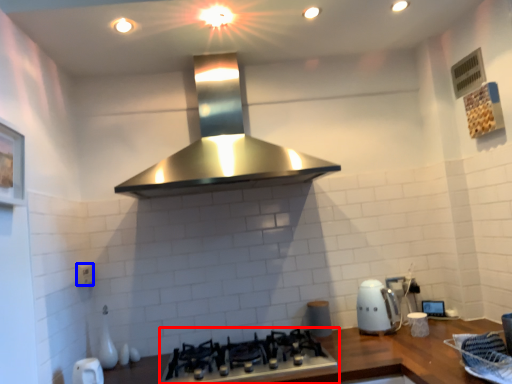
Question: Among these objects, which one is nearest to the camera, gas stove (highlighted by a red box) or electric outlet (highlighted by a blue box)?

Choices:
 (A) gas stove
 (B) electric outlet

Answer: (A)